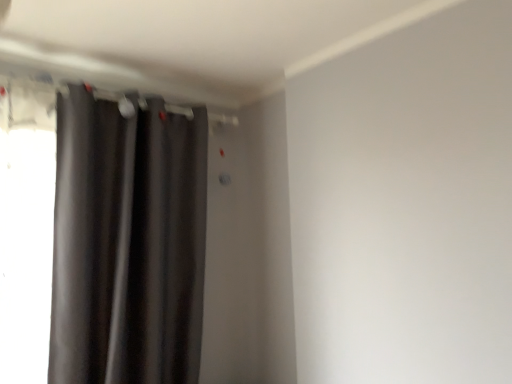
Measure the distance between point (135, 274) and camera.

7.22 feet.

Describe the element at coordinates (128, 243) in the screenshot. I see `matte black curtain at left` at that location.

Where is `matte black curtain at left`? Image resolution: width=512 pixels, height=384 pixels. matte black curtain at left is located at coordinates click(128, 243).

Find the location of a particular element. The height and width of the screenshot is (384, 512). matte black curtain at left is located at coordinates (128, 243).